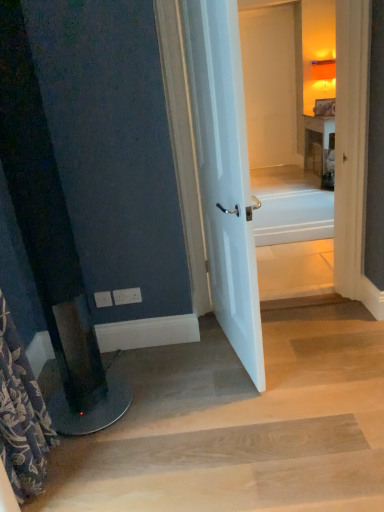
Question: Is floral fabric shower curtain at left outside of white plastic electric outlet at lower left, placed as the first electric outlet when sorted from left to right?

Choices:
 (A) yes
 (B) no

Answer: (A)

Question: Can you see floral fabric shower curtain at left touching white plastic electric outlet at lower left, placed as the first electric outlet when sorted from left to right?

Choices:
 (A) yes
 (B) no

Answer: (B)

Question: Is floral fabric shower curtain at left to the left of white plastic electric outlet at lower left, placed as the first electric outlet when sorted from left to right, from the viewer's perspective?

Choices:
 (A) yes
 (B) no

Answer: (A)

Question: Can you confirm if floral fabric shower curtain at left is wider than white plastic electric outlet at lower left, placed as the first electric outlet when sorted from left to right?

Choices:
 (A) yes
 (B) no

Answer: (A)

Question: Could you tell me if floral fabric shower curtain at left is turned towards white plastic electric outlet at lower left, placed as the first electric outlet when sorted from left to right?

Choices:
 (A) no
 (B) yes

Answer: (A)

Question: Based on their sizes in the image, would you say white glossy bathtub at center is bigger or smaller than white plastic electric outlet at lower left, acting as the first electric outlet starting from the right?

Choices:
 (A) big
 (B) small

Answer: (A)

Question: From the image's perspective, is white glossy bathtub at center located above or below white plastic electric outlet at lower left, acting as the first electric outlet starting from the right?

Choices:
 (A) above
 (B) below

Answer: (A)

Question: Is white glossy bathtub at center in front of or behind white plastic electric outlet at lower left, acting as the first electric outlet starting from the right, in the image?

Choices:
 (A) behind
 (B) front

Answer: (A)

Question: From a real-world perspective, is white glossy bathtub at center physically located above or below white plastic electric outlet at lower left, which ranks as the 2th electric outlet in left-to-right order?

Choices:
 (A) above
 (B) below

Answer: (B)

Question: Based on their sizes in the image, would you say white plastic electric outlet at lower left, the second electric outlet in the right-to-left sequence, is bigger or smaller than floral fabric shower curtain at left?

Choices:
 (A) small
 (B) big

Answer: (A)

Question: Is point (102, 290) positioned closer to the camera than point (39, 425)?

Choices:
 (A) farther
 (B) closer

Answer: (A)

Question: Based on their positions, is white plastic electric outlet at lower left, placed as the first electric outlet when sorted from left to right, located to the left or right of floral fabric shower curtain at left?

Choices:
 (A) left
 (B) right

Answer: (B)

Question: From the image's perspective, is white plastic electric outlet at lower left, placed as the first electric outlet when sorted from left to right, located above or below floral fabric shower curtain at left?

Choices:
 (A) above
 (B) below

Answer: (A)

Question: Considering the positions of point (109, 296) and point (291, 225), is point (109, 296) closer or farther from the camera than point (291, 225)?

Choices:
 (A) closer
 (B) farther

Answer: (A)

Question: In terms of width, does white plastic electric outlet at lower left, placed as the first electric outlet when sorted from left to right, look wider or thinner when compared to white glossy bathtub at center?

Choices:
 (A) wide
 (B) thin

Answer: (B)